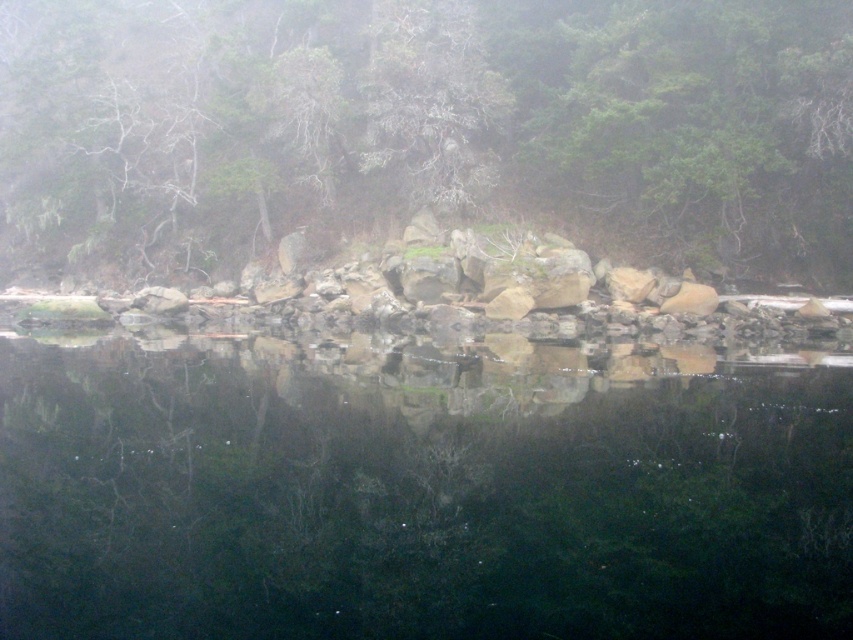
Question: Is transparent water at center further to the viewer compared to green matte tree at center?

Choices:
 (A) no
 (B) yes

Answer: (A)

Question: Which object is closer to the camera taking this photo?

Choices:
 (A) transparent water at center
 (B) green matte tree at center

Answer: (A)

Question: Which point appears farthest from the camera in this image?

Choices:
 (A) (706, 74)
 (B) (430, 596)

Answer: (A)

Question: Can you confirm if transparent water at center is positioned to the left of green matte tree at center?

Choices:
 (A) no
 (B) yes

Answer: (A)

Question: Among these points, which one is farthest from the camera?

Choices:
 (A) coord(276,456)
 (B) coord(132,51)

Answer: (B)

Question: Can you confirm if transparent water at center is wider than green matte tree at center?

Choices:
 (A) no
 (B) yes

Answer: (A)